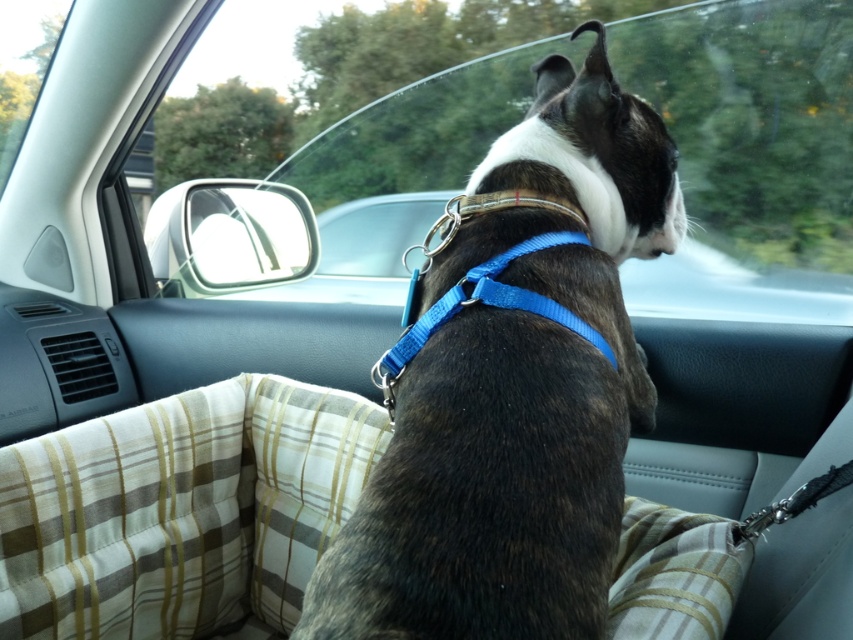
Question: Does brown textured dog at center have a smaller size compared to blue nylon neckband at center?

Choices:
 (A) no
 (B) yes

Answer: (A)

Question: Is transparent glass car window at center thinner than blue nylon neckband at center?

Choices:
 (A) no
 (B) yes

Answer: (A)

Question: Among these objects, which one is farthest from the camera?

Choices:
 (A) brown textured dog at center
 (B) blue nylon neckband at center

Answer: (B)

Question: Among these points, which one is farthest from the camera?

Choices:
 (A) (372, 452)
 (B) (364, 506)
 (C) (367, 16)

Answer: (C)

Question: Can you confirm if transparent glass car window at center is positioned to the left of blue nylon neckband at center?

Choices:
 (A) yes
 (B) no

Answer: (A)

Question: Which of the following is the closest to the observer?

Choices:
 (A) brown textured dog at center
 (B) plaid fabric dog bed at center
 (C) blue nylon neckband at center
 (D) transparent glass car window at center

Answer: (A)